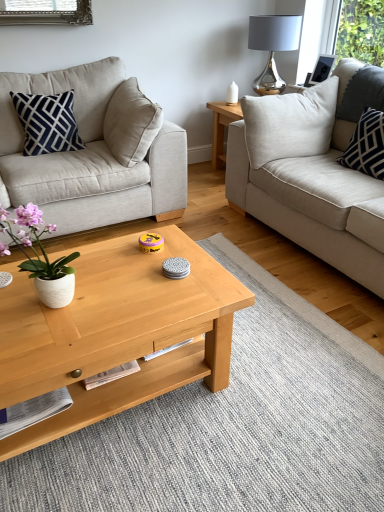
I want to click on vacant space to the left of white ceramic pot at left, so click(x=11, y=301).